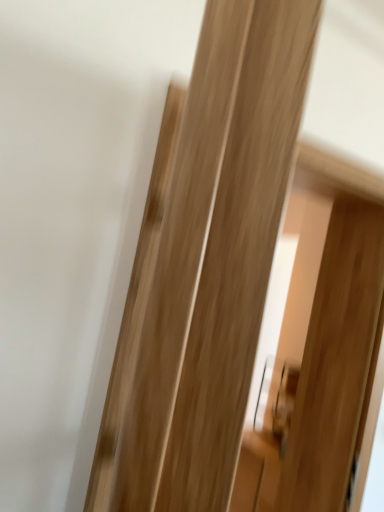
Question: Considering the relative positions of natural wood screen door at center and natural wood door at center in the image provided, is natural wood screen door at center behind natural wood door at center?

Choices:
 (A) no
 (B) yes

Answer: (B)

Question: Is natural wood door at center a part of natural wood screen door at center?

Choices:
 (A) no
 (B) yes

Answer: (A)

Question: Is natural wood screen door at center shorter than natural wood door at center?

Choices:
 (A) no
 (B) yes

Answer: (A)

Question: From the image's perspective, is natural wood screen door at center over natural wood door at center?

Choices:
 (A) yes
 (B) no

Answer: (B)

Question: From a real-world perspective, is natural wood screen door at center over natural wood door at center?

Choices:
 (A) no
 (B) yes

Answer: (A)

Question: Does natural wood screen door at center have a smaller size compared to natural wood door at center?

Choices:
 (A) no
 (B) yes

Answer: (A)

Question: From the image's perspective, is natural wood door at center over natural wood screen door at center?

Choices:
 (A) yes
 (B) no

Answer: (A)

Question: Is natural wood door at center to the right of natural wood screen door at center from the viewer's perspective?

Choices:
 (A) no
 (B) yes

Answer: (A)

Question: From a real-world perspective, is natural wood door at center located higher than natural wood screen door at center?

Choices:
 (A) no
 (B) yes

Answer: (B)

Question: Considering the relative sizes of natural wood door at center and natural wood screen door at center in the image provided, is natural wood door at center wider than natural wood screen door at center?

Choices:
 (A) yes
 (B) no

Answer: (B)

Question: Is natural wood door at center positioned far away from natural wood screen door at center?

Choices:
 (A) yes
 (B) no

Answer: (A)

Question: Is natural wood door at center at the left side of natural wood screen door at center?

Choices:
 (A) no
 (B) yes

Answer: (B)

Question: Is natural wood door at center spatially inside natural wood screen door at center, or outside of it?

Choices:
 (A) outside
 (B) inside

Answer: (A)